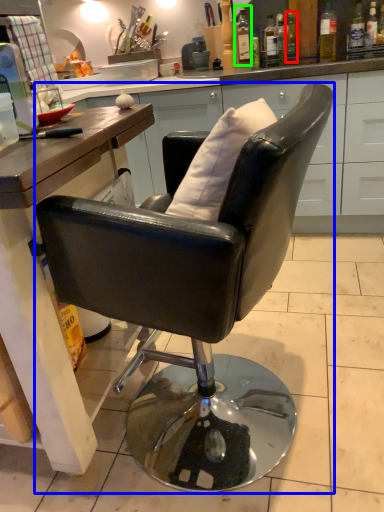
Question: Which object is the closest to the bottle (highlighted by a red box)? Choose among these: chair (highlighted by a blue box) or bottle (highlighted by a green box).

Choices:
 (A) chair
 (B) bottle

Answer: (B)